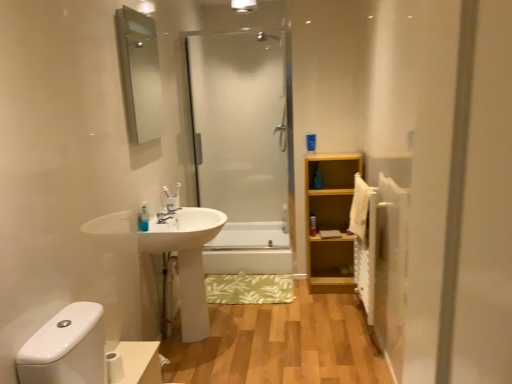
Locate an element on the screen. vacant location below white glossy sink at center left (from a real-world perspective) is located at coordinates click(x=210, y=332).